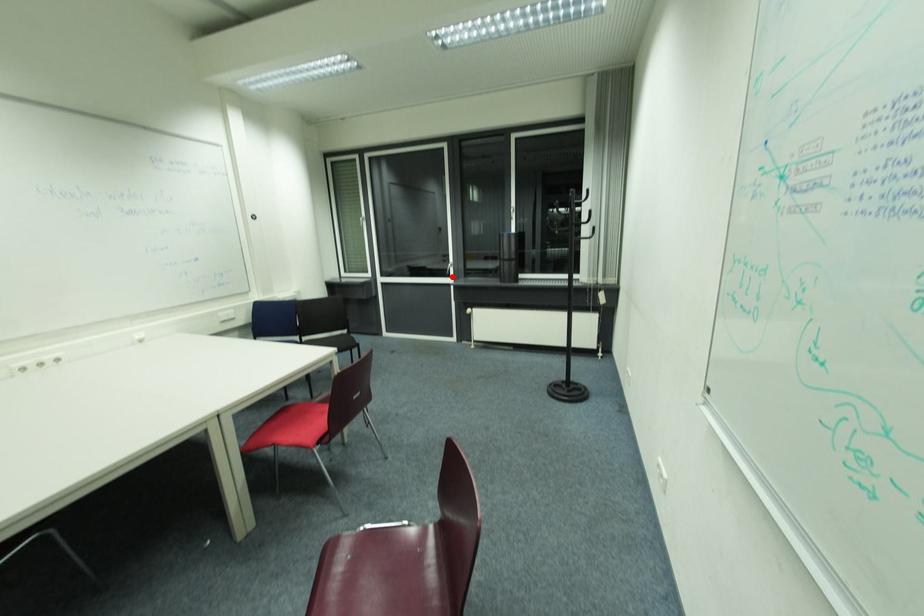
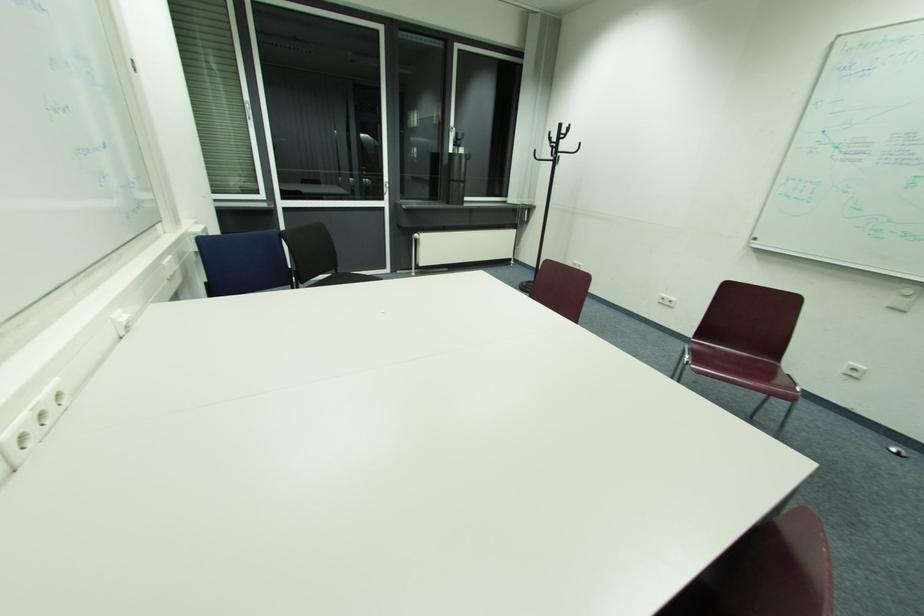
Question: I am providing you with two images of the same scene from different viewpoints. Given a red point in image1, look at the same physical point in image2. Is it:

Choices:
 (A) Closer to the viewpoint
 (B) Farther from the viewpoint

Answer: (A)